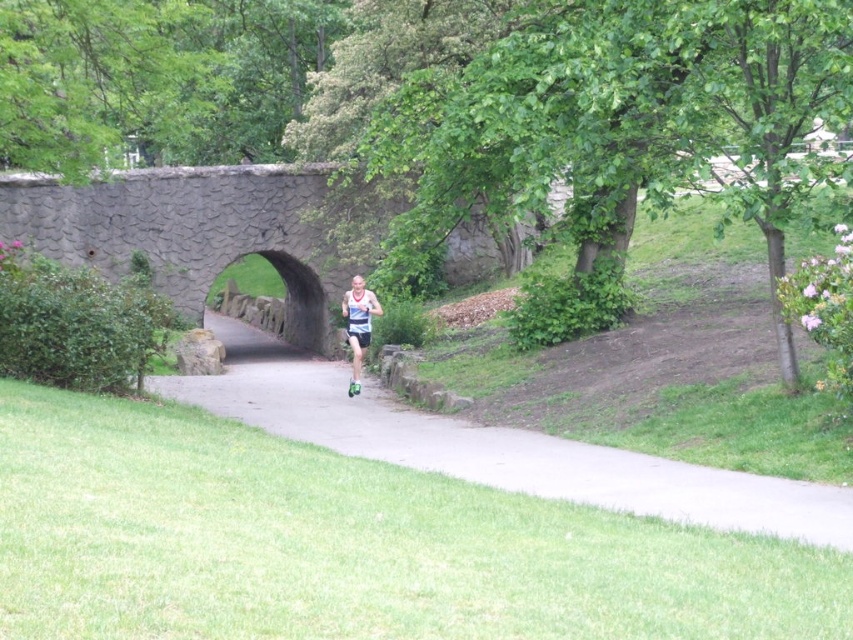
Question: Does gray asphalt path at center have a smaller size compared to matte blue tank top at center?

Choices:
 (A) yes
 (B) no

Answer: (B)

Question: Is gray asphalt path at center to the right of matte blue tank top at center from the viewer's perspective?

Choices:
 (A) no
 (B) yes

Answer: (A)

Question: Is gray asphalt path at center to the right of matte blue tank top at center from the viewer's perspective?

Choices:
 (A) yes
 (B) no

Answer: (B)